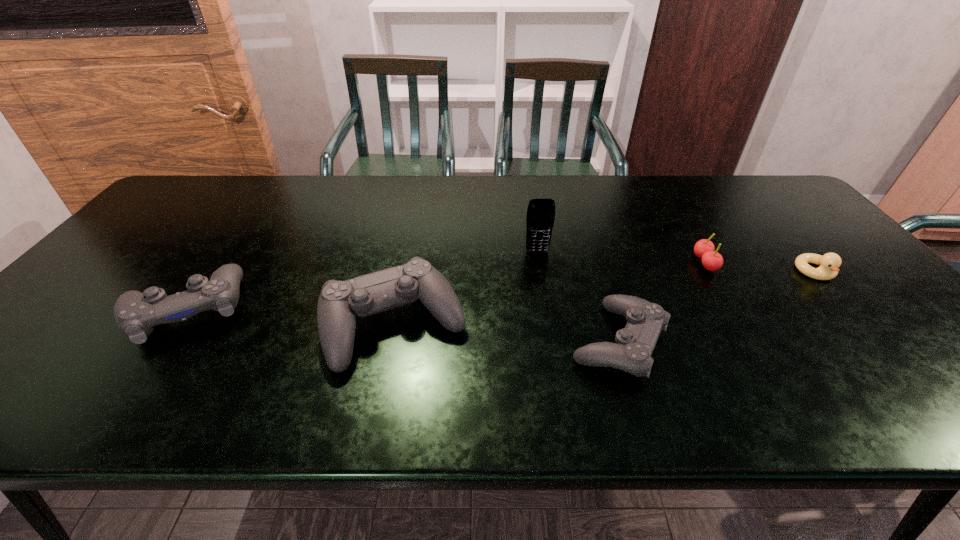
Find the location of a particular element. the closest object to the duckling is located at coordinates (712, 260).

This screenshot has width=960, height=540. Find the location of `control that is the closest one to the cellular telephone`. control that is the closest one to the cellular telephone is located at coordinates (340, 302).

Point out which control is positioned as the third nearest to the second object from right to left. Please provide its 2D coordinates. Your answer should be formatted as a tuple, i.e. [(x, y)], where the tuple contains the x and y coordinates of a point satisfying the conditions above.

[(136, 314)]

Find the location of `free spot that satisfies the following two spatial constraints: 1. on the screen of the second object from right to left; 2. on the right side of the fourth object from right to left`. free spot that satisfies the following two spatial constraints: 1. on the screen of the second object from right to left; 2. on the right side of the fourth object from right to left is located at coordinates (540, 263).

You are a GUI agent. You are given a task and a screenshot of the screen. Output one action in this format:
    pyautogui.click(x=<x>, y=<y>)
    Task: Click on the blank space that satisfies the following two spatial constraints: 1. on the screen of the cellular telephone; 2. on the left side of the shortest control
    
    Given the screenshot: What is the action you would take?
    pyautogui.click(x=552, y=341)

Locate an element on the screen. free location that satisfies the following two spatial constraints: 1. on the front side of the leftmost object; 2. on the left side of the rightmost control is located at coordinates (164, 341).